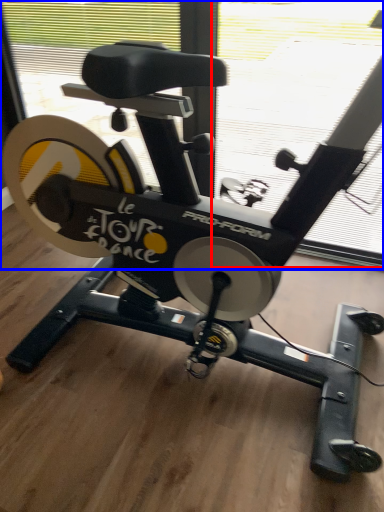
Question: Which object appears closest to the camera in this image, window screen (highlighted by a red box) or window screen (highlighted by a blue box)?

Choices:
 (A) window screen
 (B) window screen

Answer: (B)